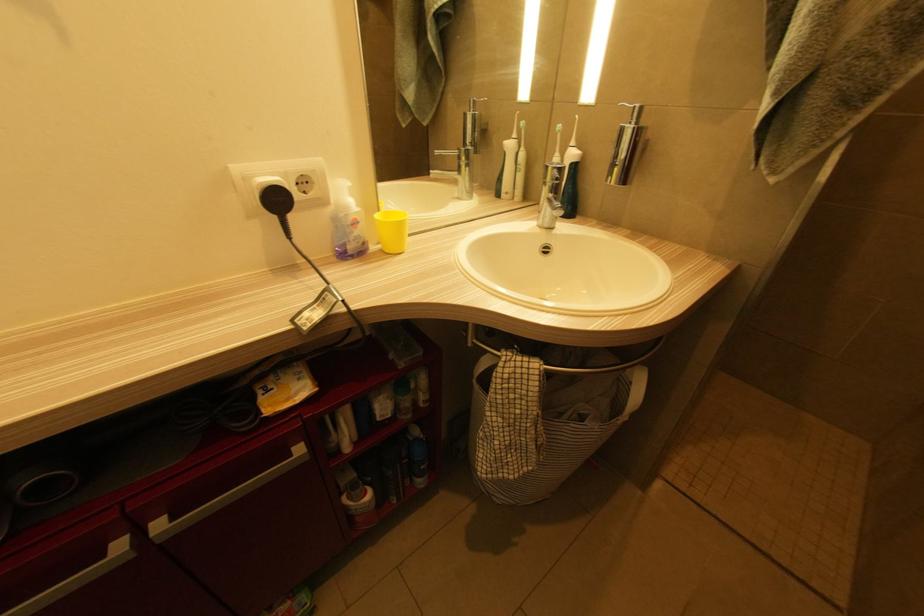
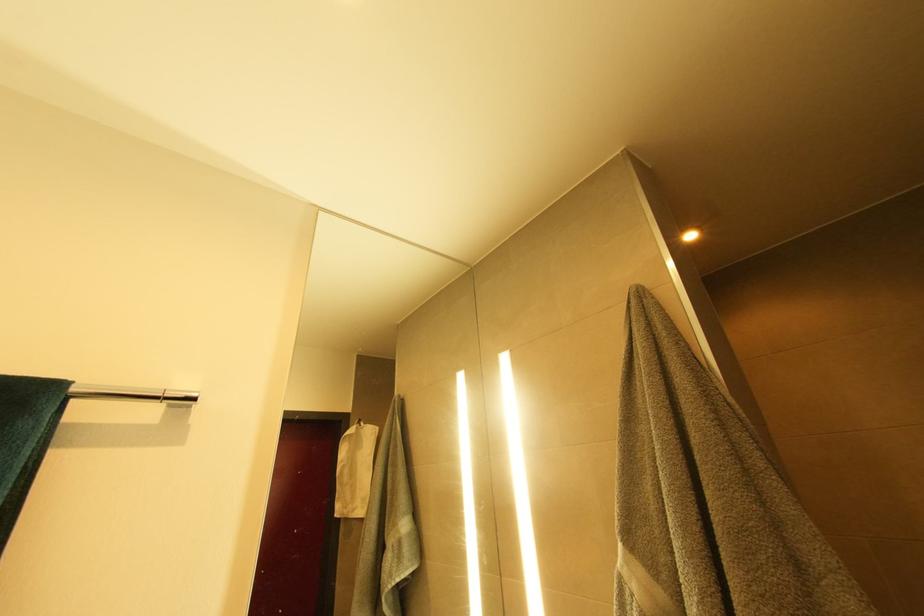
Question: The first image is from the beginning of the video and the second image is from the end. How did the camera likely rotate when shooting the video?

Choices:
 (A) Left
 (B) Right
 (C) Up
 (D) Down

Answer: (C)